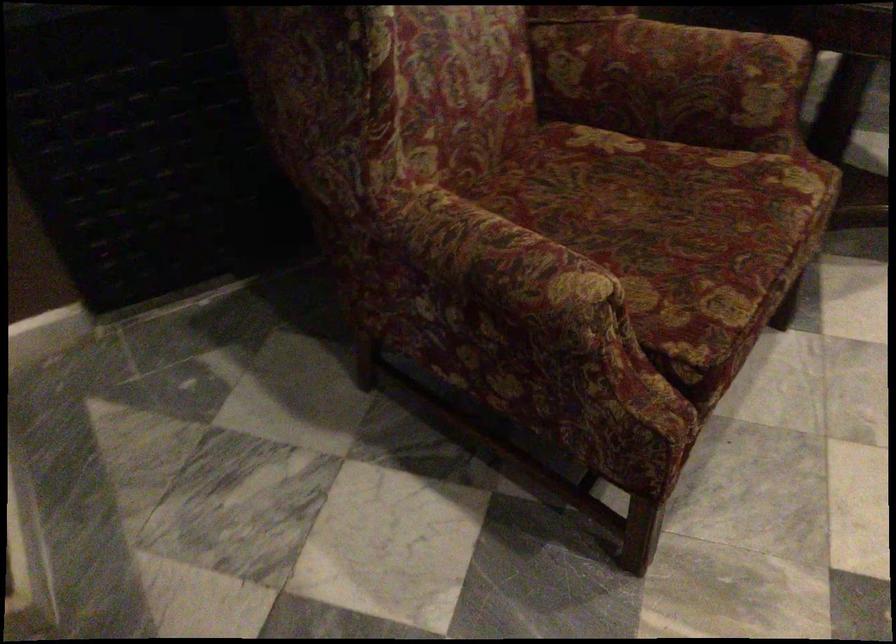
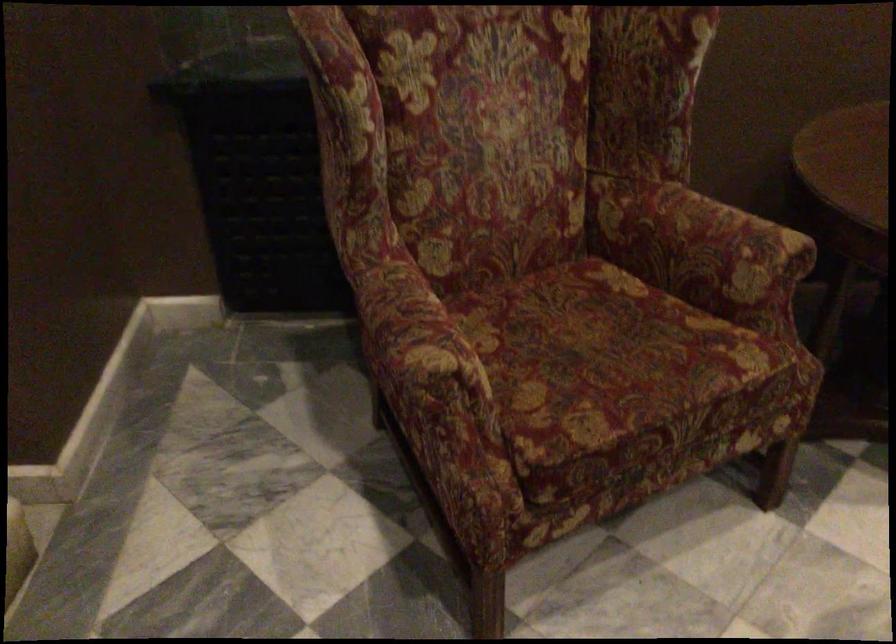
Question: Based on the continuous images, in which direction is the camera rotating? Reply with the corresponding letter.

Choices:
 (A) Left
 (B) Right
 (C) Up
 (D) Down

Answer: (A)